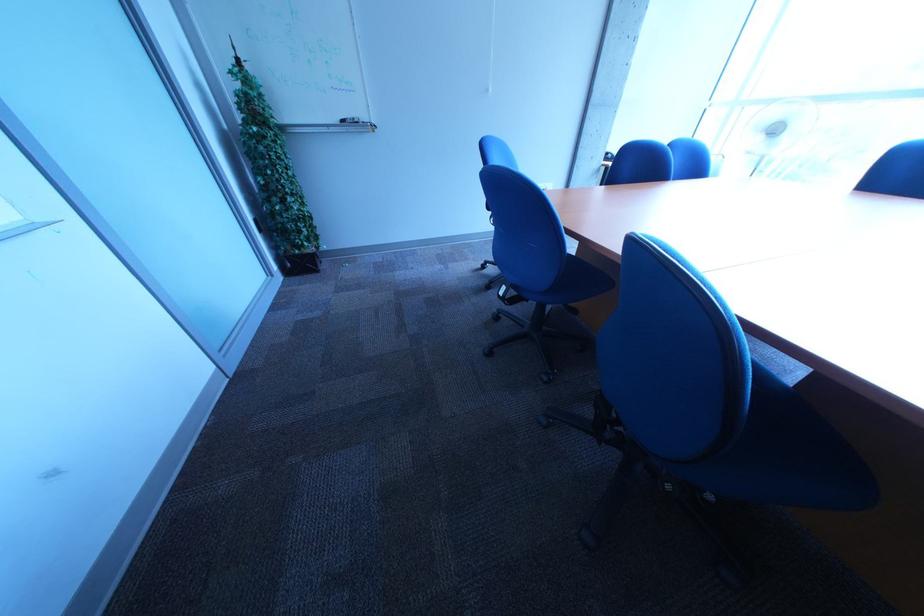
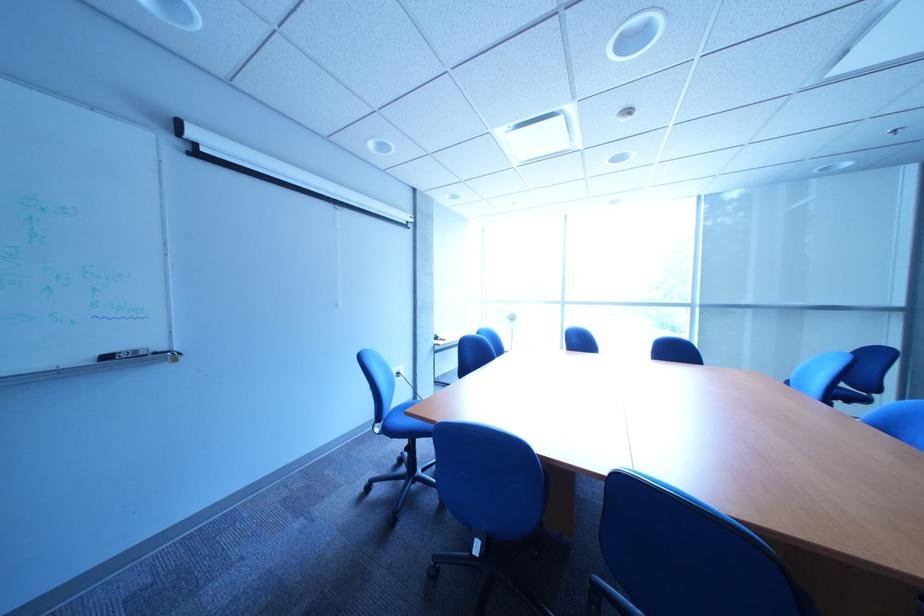
First-person continuous shooting, in which direction is the camera rotating?

The camera's rotation is toward right-up.